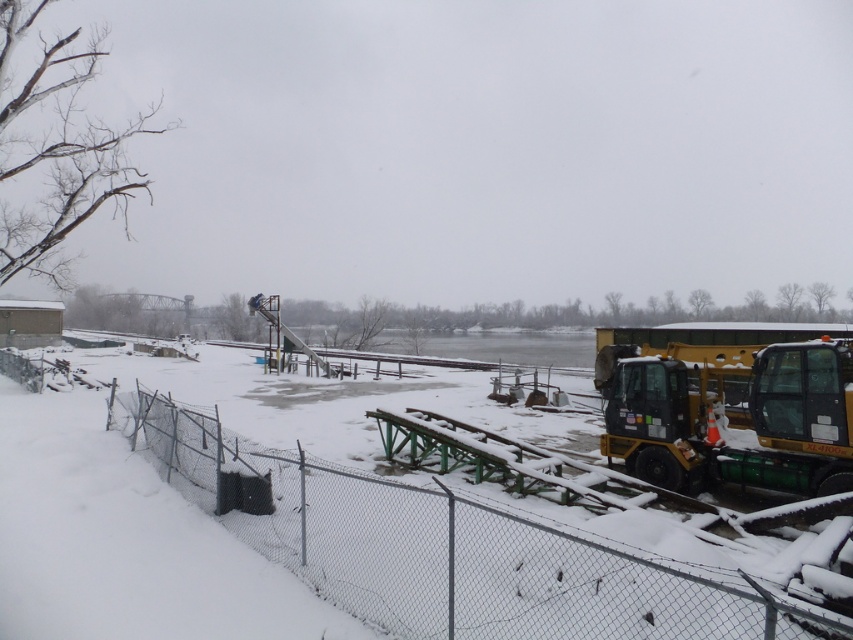
Question: Is wire mesh fence at lower left to the right of yellow rubber plow at right from the viewer's perspective?

Choices:
 (A) yes
 (B) no

Answer: (B)

Question: Which point appears closest to the camera in this image?

Choices:
 (A) 689,600
 (B) 807,396

Answer: (A)

Question: Observing the image, what is the correct spatial positioning of wire mesh fence at lower left in reference to yellow rubber plow at right?

Choices:
 (A) right
 (B) left

Answer: (B)

Question: Considering the relative positions of wire mesh fence at lower left and yellow rubber plow at right in the image provided, where is wire mesh fence at lower left located with respect to yellow rubber plow at right?

Choices:
 (A) right
 (B) left

Answer: (B)

Question: Which of the following is the farthest from the observer?

Choices:
 (A) yellow rubber plow at right
 (B) wire mesh fence at lower left

Answer: (A)